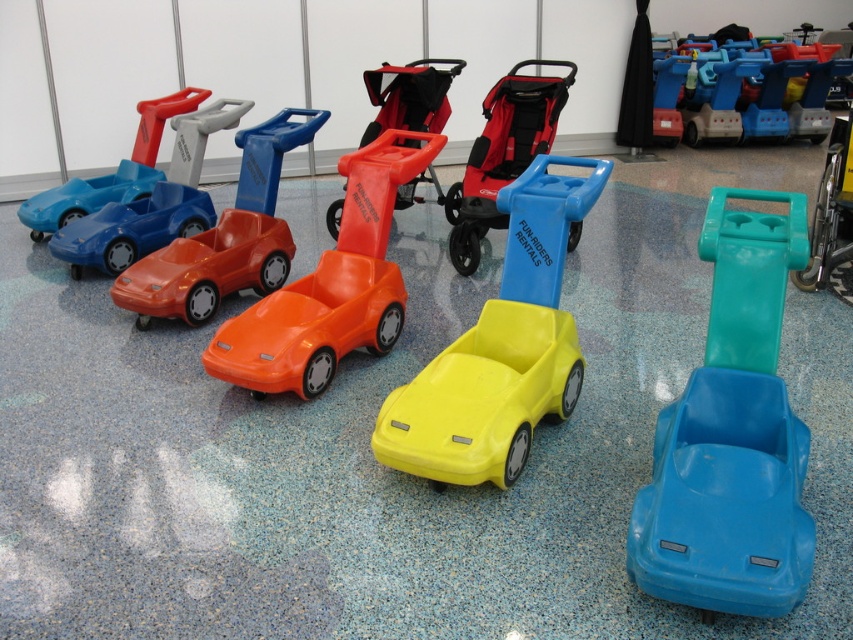
Between blue plastic car at center and matte orange car at center-left, which one is positioned higher?

matte orange car at center-left is higher up.

What do you see at coordinates (732, 435) in the screenshot? This screenshot has height=640, width=853. I see `blue plastic car at center` at bounding box center [732, 435].

Does point (790, 216) lie behind point (148, 248)?

That is False.

Locate an element on the screen. This screenshot has width=853, height=640. blue plastic car at center is located at coordinates (732, 435).

Between matte orange car at center-left and matte orange plastic car at upper left, which one has more height?

matte orange plastic car at upper left

Is matte orange car at center-left smaller than matte orange plastic car at upper left?

Yes.

Identify the location of matte orange car at center-left. Image resolution: width=853 pixels, height=640 pixels. (132, 228).

At what (x,y) coordinates should I click in order to perform the action: click on matte orange car at center-left. Please return your answer as a coordinate pair (x, y). Looking at the image, I should click on (132, 228).

Which of these two, blue plastic car at center or matte plastic stroller at center, stands taller?

matte plastic stroller at center is taller.

What are the coordinates of `blue plastic car at center` in the screenshot? It's located at (732, 435).